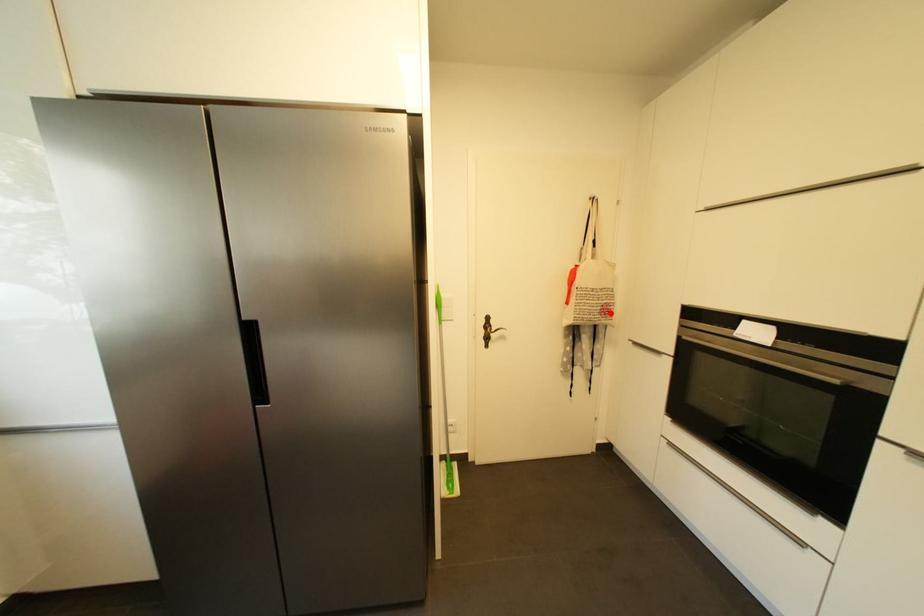
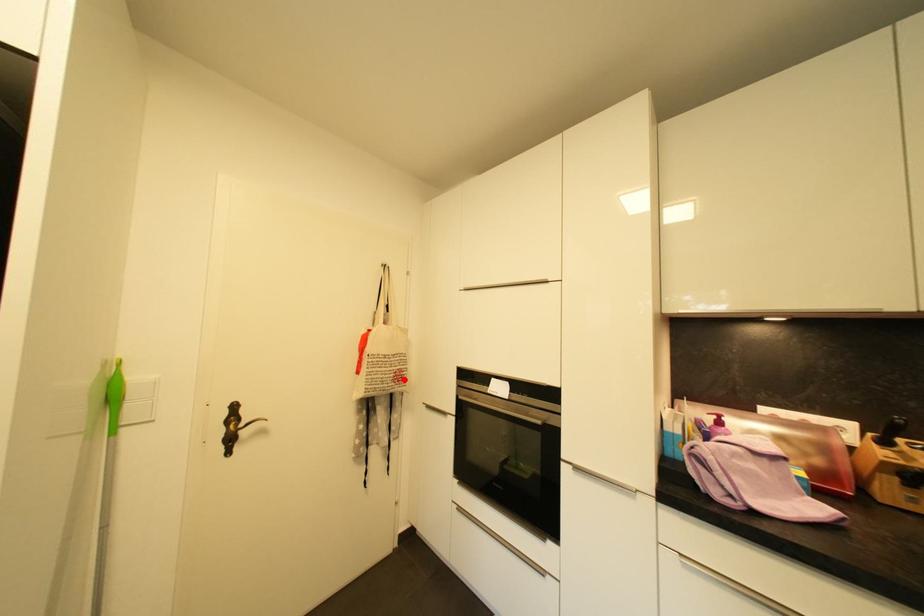
I am providing you with two images of the same scene from different viewpoints. A red point is marked on the first image and another point is marked on the second image. Is the red point in image1 aligned with the point shown in image2?

Yes